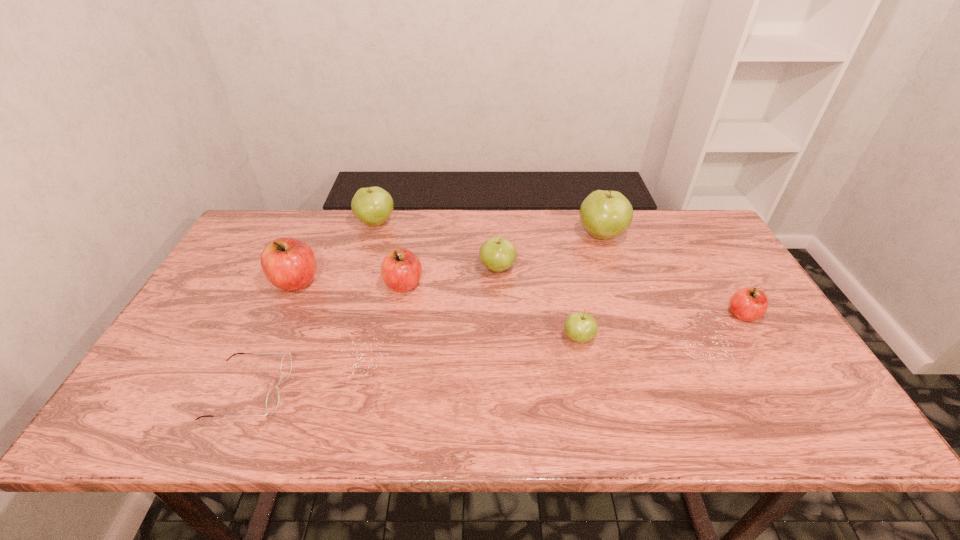
The width and height of the screenshot is (960, 540). In order to click on the third green apple from left to right in this screenshot , I will do `click(581, 327)`.

Find the location of `the third apple from right to left`. the third apple from right to left is located at coordinates (581, 327).

Locate an element on the screen. the rightmost red apple is located at coordinates (748, 304).

I want to click on the smallest red apple, so click(748, 304).

You are a GUI agent. You are given a task and a screenshot of the screen. Output one action in this format:
    pyautogui.click(x=<x>, y=<y>)
    Task: Click on the spectacles
    The width and height of the screenshot is (960, 540).
    Given the screenshot: What is the action you would take?
    pyautogui.click(x=273, y=397)

You are a GUI agent. You are given a task and a screenshot of the screen. Output one action in this format:
    pyautogui.click(x=<x>, y=<y>)
    Task: Click on the shortest object
    
    Given the screenshot: What is the action you would take?
    pyautogui.click(x=273, y=397)

Find the location of a particular element. vacant area situated 0.250m on the front of the second object from right to left is located at coordinates (627, 309).

Locate an element on the screen. This screenshot has height=540, width=960. free spot located 0.390m on the right of the second biggest green apple is located at coordinates (513, 223).

The width and height of the screenshot is (960, 540). I want to click on free spot located on the right of the leftmost red apple, so click(x=342, y=282).

At what (x,y) coordinates should I click in order to perform the action: click on vacant point located on the front of the second nearest green apple. Please return your answer as a coordinate pair (x, y). Image resolution: width=960 pixels, height=540 pixels. Looking at the image, I should click on (499, 316).